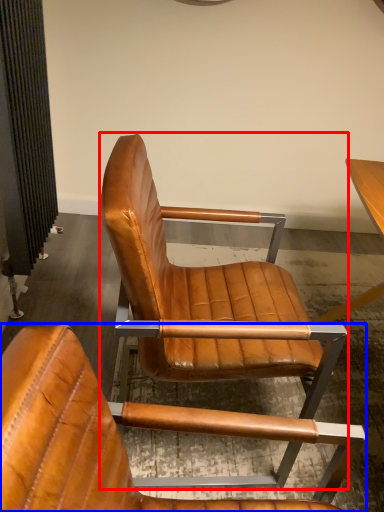
Question: Which of the following is the closest to the observer, chair (highlighted by a red box) or chair (highlighted by a blue box)?

Choices:
 (A) chair
 (B) chair

Answer: (B)